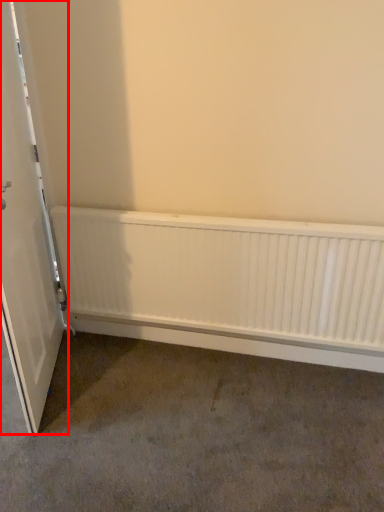
Question: From the image's perspective, considering the relative positions of door (annotated by the red box) and radiator in the image provided, where is door (annotated by the red box) located with respect to the staircase?

Choices:
 (A) below
 (B) above

Answer: (B)